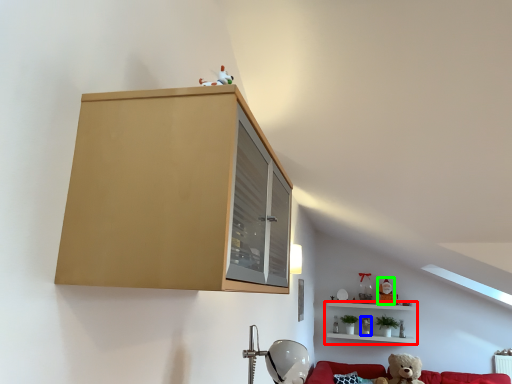
Question: Which object is the closest to the shelf (highlighted by a red box)? Choose among these: toy (highlighted by a blue box) or toy (highlighted by a green box).

Choices:
 (A) toy
 (B) toy

Answer: (B)